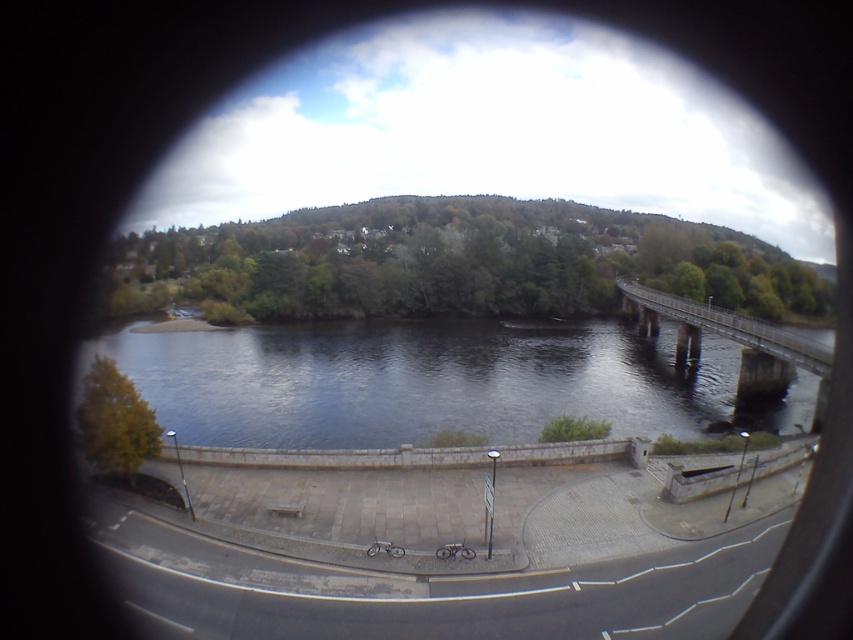
Does point (287, 419) come in front of point (717, 308)?

Yes.

The width and height of the screenshot is (853, 640). Identify the location of dark blue water at center. (432, 381).